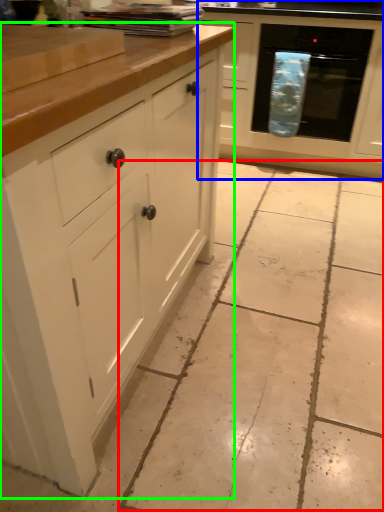
Question: Which is nearer to the concrete (highlighted by a red box)? cabinetry (highlighted by a blue box) or cabinetry (highlighted by a green box).

Choices:
 (A) cabinetry
 (B) cabinetry

Answer: (B)